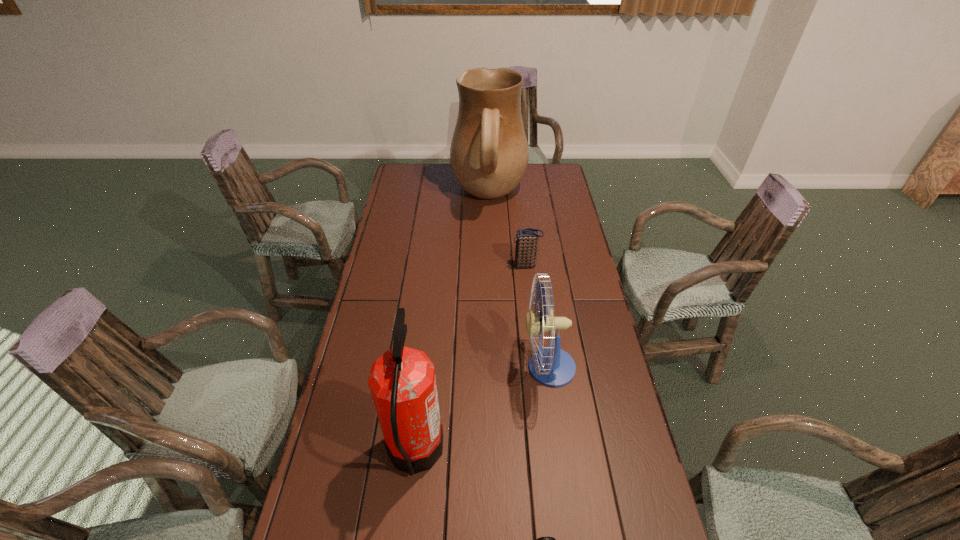
Where is `the tallest object`? the tallest object is located at coordinates (489, 153).

Find the location of `cream pitcher`. cream pitcher is located at coordinates pyautogui.click(x=489, y=153).

Locate an element on the screen. Image resolution: width=960 pixels, height=540 pixels. the fourth farthest object is located at coordinates (402, 382).

Identify the location of the second tallest object. The width and height of the screenshot is (960, 540). (402, 382).

I want to click on fan, so click(551, 366).

Locate an element on the screen. the third shortest object is located at coordinates (551, 366).

Locate an element on the screen. the taller clutch bag is located at coordinates (527, 239).

The width and height of the screenshot is (960, 540). Find the location of `the farther clutch bag`. the farther clutch bag is located at coordinates (527, 239).

In order to click on free space located at the spout of the farthest object in this screenshot , I will do tap(432, 197).

This screenshot has width=960, height=540. What are the coordinates of `vacant space positioned at the spout of the farthest object` in the screenshot? It's located at (403, 197).